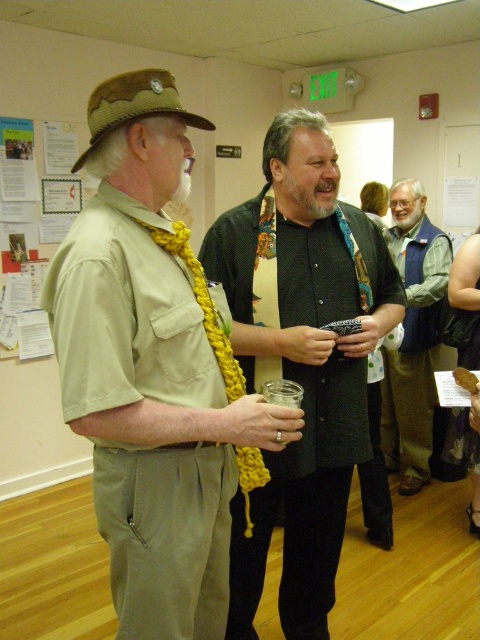
You are standing in the room and want to hand a document to both the matte khaki shirt at left and the black matte shirt at center. Which person should you approach first to ensure you reach them in the shortest distance?

You should approach the matte khaki shirt at left first because they are closer to you than the black matte shirt at center, so reaching them first requires less distance.